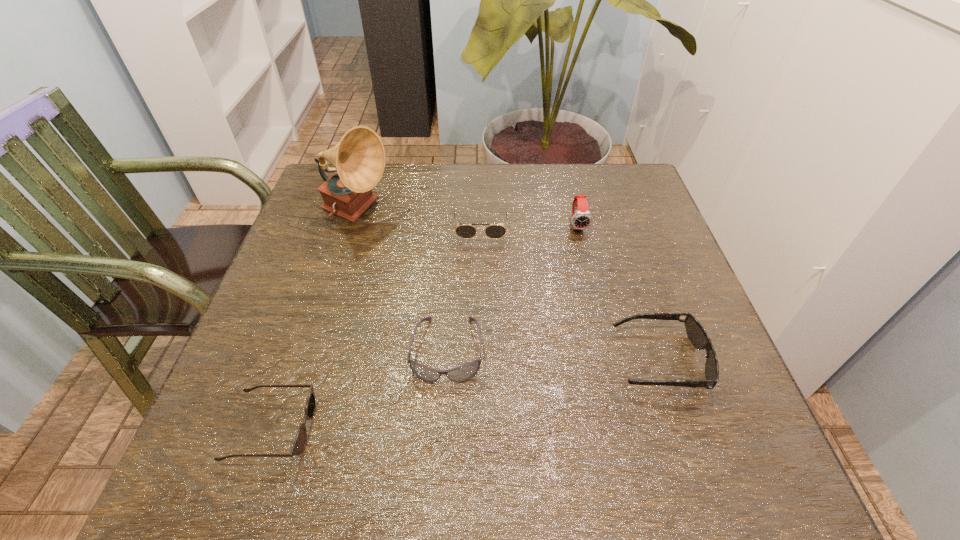
Identify the location of vacant region located on the front-facing side of the rightmost sunglasses. (404, 360).

Image resolution: width=960 pixels, height=540 pixels. I want to click on vacant space located 0.080m on the front-facing side of the rightmost sunglasses, so click(x=574, y=360).

Where is `blank area located 0.100m on the front-facing side of the rightmost sunglasses`? The height and width of the screenshot is (540, 960). blank area located 0.100m on the front-facing side of the rightmost sunglasses is located at coordinates (564, 360).

The image size is (960, 540). What are the coordinates of `vacant space located 0.240m on the front lenses of the leftmost sunglasses` in the screenshot? It's located at (454, 429).

The image size is (960, 540). In order to click on phonograph record located at the far edge in this screenshot , I will do `click(359, 158)`.

Locate an element on the screen. watch that is at the far edge is located at coordinates click(x=581, y=219).

This screenshot has height=540, width=960. I want to click on object situated at the near edge, so click(x=299, y=444).

Locate an element on the screen. The width and height of the screenshot is (960, 540). phonograph record positioned at the left edge is located at coordinates (359, 158).

The width and height of the screenshot is (960, 540). I want to click on sunglasses situated at the left edge, so click(x=299, y=444).

The height and width of the screenshot is (540, 960). What are the coordinates of `object located in the right edge section of the desktop` in the screenshot? It's located at (696, 333).